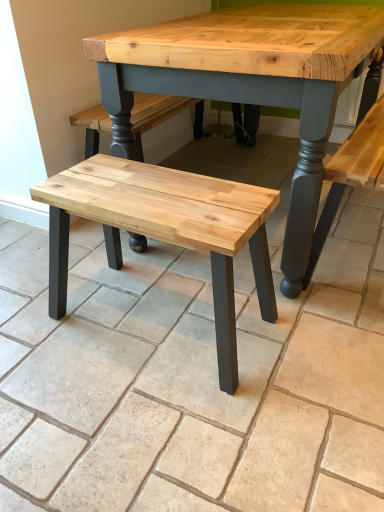
Question: Is natural wood bench at center smaller than natural wood stool at center?

Choices:
 (A) no
 (B) yes

Answer: (A)

Question: Is natural wood bench at center at the right side of natural wood stool at center?

Choices:
 (A) yes
 (B) no

Answer: (A)

Question: Is natural wood bench at center not within natural wood stool at center?

Choices:
 (A) no
 (B) yes

Answer: (B)

Question: Is the position of natural wood bench at center more distant than that of natural wood stool at center?

Choices:
 (A) no
 (B) yes

Answer: (A)

Question: Is natural wood stool at center a part of natural wood bench at center?

Choices:
 (A) yes
 (B) no

Answer: (B)

Question: Is natural wood stool at center at the back of natural wood bench at center?

Choices:
 (A) yes
 (B) no

Answer: (B)

Question: From a real-world perspective, is natural wood stool at center physically above natural wood bench at center?

Choices:
 (A) no
 (B) yes

Answer: (B)

Question: Can you confirm if natural wood stool at center is taller than natural wood bench at center?

Choices:
 (A) no
 (B) yes

Answer: (B)

Question: Is natural wood stool at center smaller than natural wood bench at center?

Choices:
 (A) no
 (B) yes

Answer: (B)

Question: From the image's perspective, is natural wood stool at center on natural wood bench at center?

Choices:
 (A) no
 (B) yes

Answer: (A)

Question: Can you confirm if natural wood stool at center is shorter than natural wood bench at center?

Choices:
 (A) no
 (B) yes

Answer: (A)

Question: Is natural wood stool at center thinner than natural wood bench at center?

Choices:
 (A) no
 (B) yes

Answer: (B)

Question: Considering the positions of natural wood stool at center and natural wood bench at center in the image, is natural wood stool at center taller or shorter than natural wood bench at center?

Choices:
 (A) short
 (B) tall

Answer: (B)